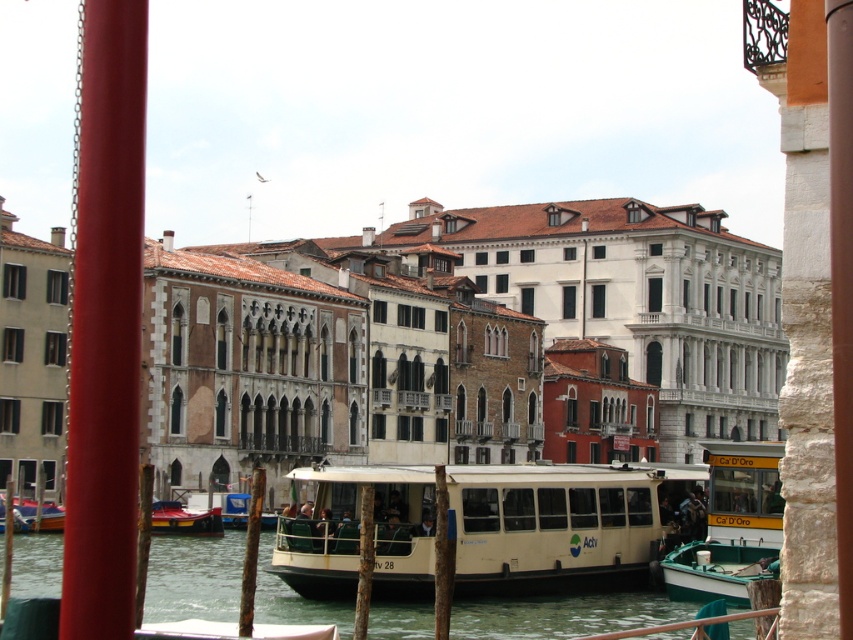
Is green painted wood boat at lower right to the right of metallic red boat at lower left from the viewer's perspective?

Indeed, green painted wood boat at lower right is positioned on the right side of metallic red boat at lower left.

Is green painted wood boat at lower right wider than metallic red boat at lower left?

Correct, the width of green painted wood boat at lower right exceeds that of metallic red boat at lower left.

The height and width of the screenshot is (640, 853). What do you see at coordinates (732, 525) in the screenshot?
I see `green painted wood boat at lower right` at bounding box center [732, 525].

At what (x,y) coordinates should I click in order to perform the action: click on green painted wood boat at lower right. Please return your answer as a coordinate pair (x, y). This screenshot has height=640, width=853. Looking at the image, I should click on (732, 525).

Image resolution: width=853 pixels, height=640 pixels. Identify the location of beige rubber boat at center. (477, 529).

Who is more forward, (467, 560) or (265, 602)?

Positioned in front is point (467, 560).

The width and height of the screenshot is (853, 640). I want to click on beige rubber boat at center, so click(477, 529).

This screenshot has height=640, width=853. I want to click on beige rubber boat at center, so click(x=477, y=529).

Is green water at center to the left of wooden boat at lower left from the viewer's perspective?

No, green water at center is not to the left of wooden boat at lower left.

Can you confirm if green water at center is positioned above wooden boat at lower left?

No, green water at center is not above wooden boat at lower left.

Is point (270, 579) positioned in front of point (25, 512)?

Yes.

Locate an element on the screen. Image resolution: width=853 pixels, height=640 pixels. green water at center is located at coordinates (564, 614).